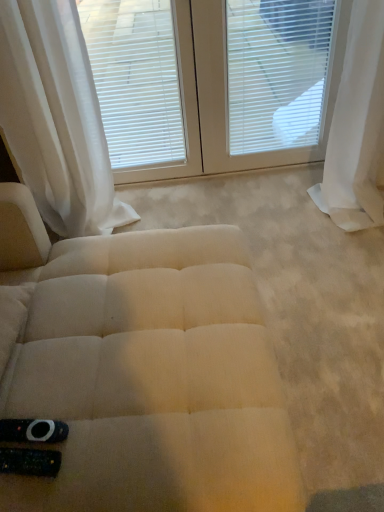
The width and height of the screenshot is (384, 512). What are the coordinates of `free region on the left part of white sheer curtain at right, the second curtain positioned from the left` in the screenshot? It's located at 289,216.